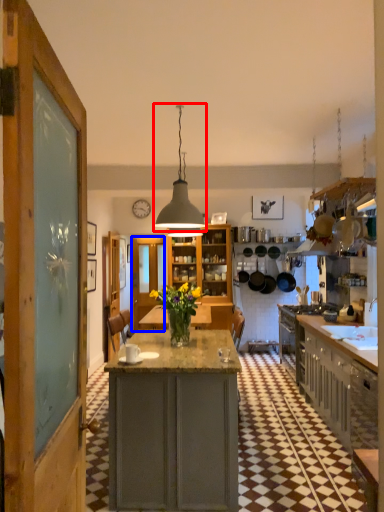
Question: Which point is closer to the camera, light fixture (highlighted by a red box) or glass door (highlighted by a blue box)?

Choices:
 (A) light fixture
 (B) glass door

Answer: (A)